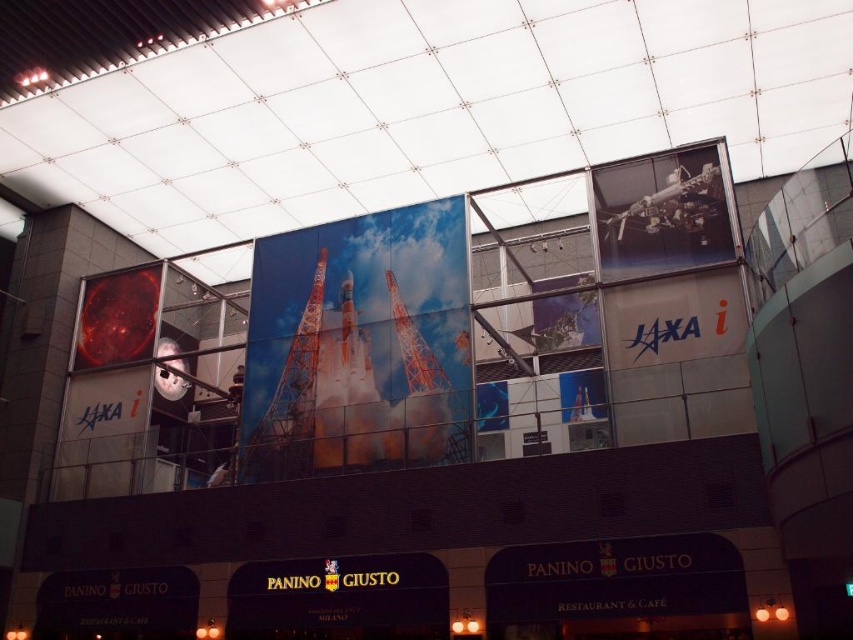
Does point (364, 438) come farther from viewer compared to point (271, 448)?

No.

Does orange matte rocket at center have a lesser height compared to metallic orange rocket at center?

Indeed, orange matte rocket at center has a lesser height compared to metallic orange rocket at center.

Where is `orange matte rocket at center`? Image resolution: width=853 pixels, height=640 pixels. orange matte rocket at center is located at coordinates (346, 392).

Looking at this image, does metallic rocket at center have a greater width compared to orange matte rocket at center?

Yes.

The height and width of the screenshot is (640, 853). Describe the element at coordinates (358, 344) in the screenshot. I see `metallic rocket at center` at that location.

The width and height of the screenshot is (853, 640). I want to click on metallic rocket at center, so click(x=358, y=344).

Does metallic rocket at center have a lesser width compared to metallic orange rocket at center?

No.

Who is positioned more to the right, metallic rocket at center or metallic orange rocket at center?

Positioned to the right is metallic rocket at center.

Locate an element on the screen. metallic rocket at center is located at coordinates (358, 344).